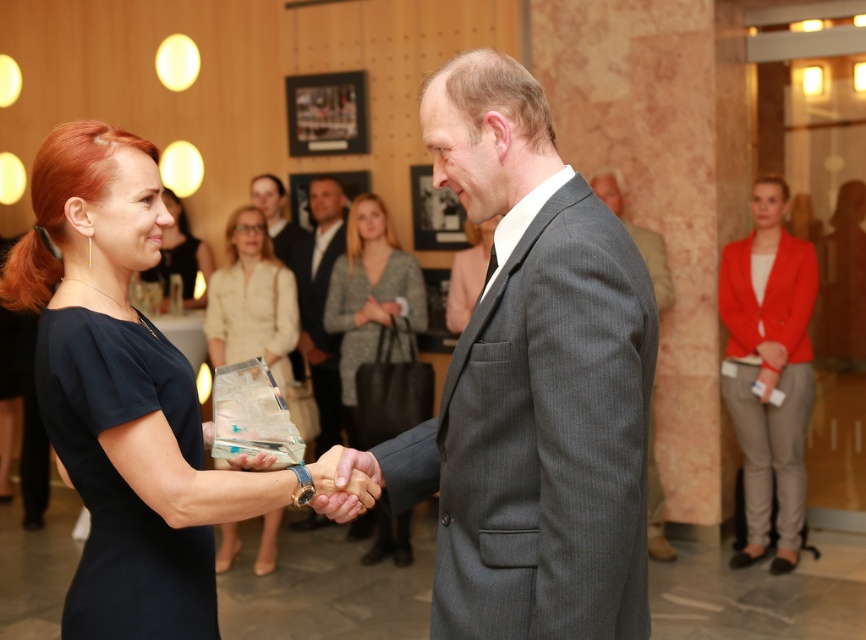
Question: Which object is the closest to the black matte dress at center?

Choices:
 (A) gray pinstripe suit at center
 (B) matte gray sweater at center
 (C) matte pink suit at center

Answer: (C)

Question: Does matte orange blazer at right have a lesser width compared to matte black dress at center?

Choices:
 (A) no
 (B) yes

Answer: (A)

Question: Where is gray wool suit at center located in relation to transparent glass award at center in the image?

Choices:
 (A) below
 (B) above

Answer: (A)

Question: Which object is farther from the camera taking this photo?

Choices:
 (A) matte pink suit at center
 (B) matte gray suit at center
 (C) gray suit at center

Answer: (B)

Question: Which of the following is the farthest from the observer?

Choices:
 (A) tap(143, 326)
 (B) tap(333, 301)
 (C) tap(53, 339)
 (D) tap(337, 202)

Answer: (D)

Question: Is black matte dress at center below transparent glass award at center?

Choices:
 (A) no
 (B) yes

Answer: (B)